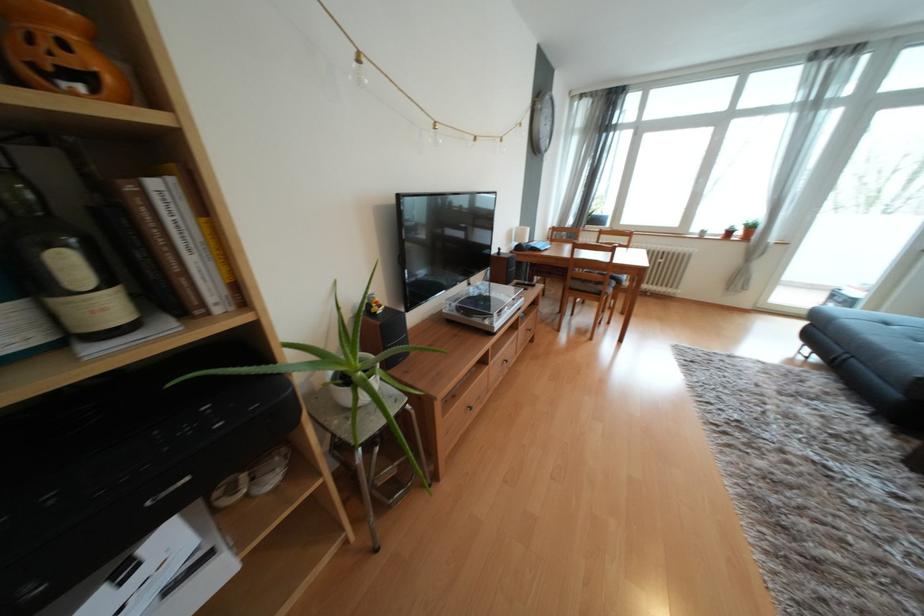
Describe the element at coordinates (58, 52) in the screenshot. This screenshot has width=924, height=616. I see `the orange pumpkin decoration` at that location.